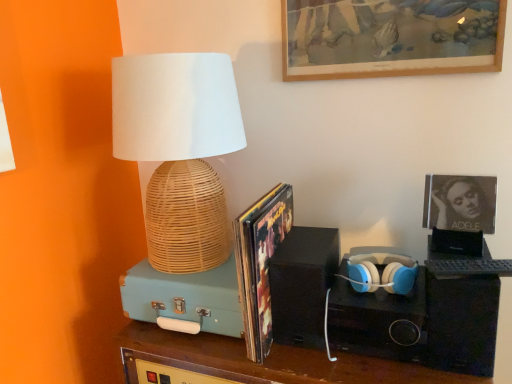
Describe the element at coordinates (184, 299) in the screenshot. I see `teal matte suitcase at left, which is the 1th speaker from left to right` at that location.

This screenshot has height=384, width=512. Identify the location of black matte speaker at center, which is the second speaker from left to right. (302, 284).

I want to click on matte white and blue plastic headphones at center right, so click(x=382, y=273).

What do you see at coordinates (179, 150) in the screenshot? I see `woven bamboo lamp at left` at bounding box center [179, 150].

The image size is (512, 384). What do you see at coordinates (260, 263) in the screenshot? I see `shiny paper magazine at center` at bounding box center [260, 263].

Describe the element at coordinates (255, 363) in the screenshot. This screenshot has height=384, width=512. I see `teal suitcase at center` at that location.

Where is `black matte speaker at right, which appears as the first speaker when viewed from the right`? black matte speaker at right, which appears as the first speaker when viewed from the right is located at coordinates (462, 323).

Is black matte speaker at right, which appears as the first speaker when viewed from the right, with wooden picture frame at upper center, marked as the first picture frame in a top-to-bottom arrangement?

black matte speaker at right, which appears as the first speaker when viewed from the right, and wooden picture frame at upper center, marked as the first picture frame in a top-to-bottom arrangement, are not in contact.

From a real-world perspective, is black matte speaker at right, which appears as the first speaker when viewed from the right, located beneath wooden picture frame at upper center, the 2th picture frame in the bottom-to-top sequence?

Yes, from a real-world perspective, black matte speaker at right, which appears as the first speaker when viewed from the right, is below wooden picture frame at upper center, the 2th picture frame in the bottom-to-top sequence.

Considering the relative sizes of black matte speaker at right, which appears as the first speaker when viewed from the right, and wooden picture frame at upper center, marked as the first picture frame in a top-to-bottom arrangement, in the image provided, is black matte speaker at right, which appears as the first speaker when viewed from the right, shorter than wooden picture frame at upper center, marked as the first picture frame in a top-to-bottom arrangement,?

Incorrect, the height of black matte speaker at right, which appears as the first speaker when viewed from the right, does not fall short of that of wooden picture frame at upper center, marked as the first picture frame in a top-to-bottom arrangement.

Between black matte speaker at right, the 3th speaker positioned from the left, and wooden picture frame at upper center, the 2th picture frame in the bottom-to-top sequence, which one has larger size?

Bigger between the two is black matte speaker at right, the 3th speaker positioned from the left.

From a real-world perspective, who is located lower, wooden picture frame at upper center, marked as the first picture frame in a top-to-bottom arrangement, or black matte speaker at right, the 3th speaker positioned from the left?

In real-world perspective, black matte speaker at right, the 3th speaker positioned from the left, is lower.

Considering the sizes of objects wooden picture frame at upper center, marked as the first picture frame in a top-to-bottom arrangement, and black matte speaker at right, which appears as the first speaker when viewed from the right, in the image provided, who is thinner, wooden picture frame at upper center, marked as the first picture frame in a top-to-bottom arrangement, or black matte speaker at right, which appears as the first speaker when viewed from the right,?

wooden picture frame at upper center, marked as the first picture frame in a top-to-bottom arrangement.

Can you see wooden picture frame at upper center, marked as the first picture frame in a top-to-bottom arrangement, touching black matte speaker at right, the 3th speaker positioned from the left?

No, wooden picture frame at upper center, marked as the first picture frame in a top-to-bottom arrangement, is not next to black matte speaker at right, the 3th speaker positioned from the left.

Which of these two, wooden picture frame at upper center, marked as the first picture frame in a top-to-bottom arrangement, or black matte speaker at right, the 3th speaker positioned from the left, is bigger?

With larger size is black matte speaker at right, the 3th speaker positioned from the left.

Is wooden picture frame at upper center, the 2th picture frame in the bottom-to-top sequence, further to camera compared to black matte speaker at center, marked as the second speaker in a right-to-left arrangement?

Yes.

In terms of height, does wooden picture frame at upper center, the 2th picture frame in the bottom-to-top sequence, look taller or shorter compared to black matte speaker at center, marked as the second speaker in a right-to-left arrangement?

wooden picture frame at upper center, the 2th picture frame in the bottom-to-top sequence, is shorter than black matte speaker at center, marked as the second speaker in a right-to-left arrangement.

From the picture: Are wooden picture frame at upper center, the 2th picture frame in the bottom-to-top sequence, and black matte speaker at center, which is the second speaker from left to right, located far from each other?

No, wooden picture frame at upper center, the 2th picture frame in the bottom-to-top sequence, is in close proximity to black matte speaker at center, which is the second speaker from left to right.

Does black matte speaker at right, which appears as the first speaker when viewed from the right, have a lesser height compared to matte black album cover at upper right, which ranks as the second picture frame in top-to-bottom order?

In fact, black matte speaker at right, which appears as the first speaker when viewed from the right, may be taller than matte black album cover at upper right, which ranks as the second picture frame in top-to-bottom order.

From a real-world perspective, which object rests below the other?

black matte speaker at right, which appears as the first speaker when viewed from the right, from a real-world perspective.

Does point (481, 306) lie behind point (476, 181)?

That is False.

Would you say black matte speaker at right, the 3th speaker positioned from the left, is inside or outside matte black album cover at upper right, which ranks as the second picture frame in top-to-bottom order?

The correct answer is: outside.

Where is `headphones above the teal matte suitcase at left, which appears as the 3th speaker when viewed from the right (from the image's perspective)`? The height and width of the screenshot is (384, 512). headphones above the teal matte suitcase at left, which appears as the 3th speaker when viewed from the right (from the image's perspective) is located at coordinates (382, 273).

How different are the orientations of matte white and blue plastic headphones at center right and teal matte suitcase at left, which is the 1th speaker from left to right, in degrees?

1.74 degrees separate the facing orientations of matte white and blue plastic headphones at center right and teal matte suitcase at left, which is the 1th speaker from left to right.

Between point (356, 260) and point (128, 287), which one is positioned behind?

Point (128, 287)

From a real-world perspective, does matte white and blue plastic headphones at center right sit lower than teal matte suitcase at left, which is the 1th speaker from left to right?

Actually, matte white and blue plastic headphones at center right is physically above teal matte suitcase at left, which is the 1th speaker from left to right, in the real world.

From a real-world perspective, is black matte speaker at center, marked as the second speaker in a right-to-left arrangement, positioned under woven bamboo lamp at left based on gravity?

Correct, in the physical world, black matte speaker at center, marked as the second speaker in a right-to-left arrangement, is lower than woven bamboo lamp at left.

Which is less distant, (317,315) or (208,75)?

The point (317,315) is closer to the camera.

Locate an element on the screen. The image size is (512, 384). lamp in front of the black matte speaker at center, which is the second speaker from left to right is located at coordinates [x=179, y=150].

Is black matte speaker at center, which is the second speaker from left to right, not within woven bamboo lamp at left?

Indeed, black matte speaker at center, which is the second speaker from left to right, is completely outside woven bamboo lamp at left.

How different are the orientations of wooden picture frame at upper center, the 2th picture frame in the bottom-to-top sequence, and teal suitcase at center in degrees?

The facing directions of wooden picture frame at upper center, the 2th picture frame in the bottom-to-top sequence, and teal suitcase at center are 0.368 degrees apart.

Does point (297, 10) appear closer or farther from the camera than point (350, 375)?

Point (297, 10) is positioned farther from the camera compared to point (350, 375).

Who is more distant, wooden picture frame at upper center, the 2th picture frame in the bottom-to-top sequence, or teal suitcase at center?

wooden picture frame at upper center, the 2th picture frame in the bottom-to-top sequence, is behind.

Can you confirm if wooden picture frame at upper center, the 2th picture frame in the bottom-to-top sequence, is thinner than teal suitcase at center?

Indeed, wooden picture frame at upper center, the 2th picture frame in the bottom-to-top sequence, has a lesser width compared to teal suitcase at center.

Locate an element on the screen. Image resolution: width=512 pixels, height=384 pixels. speaker on the right of wooden picture frame at upper center, the 2th picture frame in the bottom-to-top sequence is located at coordinates (462, 323).

There is a wooden picture frame at upper center, the 2th picture frame in the bottom-to-top sequence. Where is `the 1st speaker below it (from a real-world perspective)`? The image size is (512, 384). the 1st speaker below it (from a real-world perspective) is located at coordinates (462, 323).

In the scene shown: Based on their spatial positions, is teal matte suitcase at left, which appears as the 3th speaker when viewed from the right, or teal suitcase at center further from black matte speaker at right, which appears as the first speaker when viewed from the right?

teal matte suitcase at left, which appears as the 3th speaker when viewed from the right, is further to black matte speaker at right, which appears as the first speaker when viewed from the right.

Looking at the image, which one is located further to shiny paper magazine at center, matte black album cover at upper right, which ranks as the first picture frame in bottom-to-top order, or teal matte suitcase at left, which appears as the 3th speaker when viewed from the right?

matte black album cover at upper right, which ranks as the first picture frame in bottom-to-top order, is positioned further to the anchor shiny paper magazine at center.

Based on their spatial positions, is teal suitcase at center or matte white and blue plastic headphones at center right closer to matte black album cover at upper right, which ranks as the first picture frame in bottom-to-top order?

matte white and blue plastic headphones at center right is positioned closer to the anchor matte black album cover at upper right, which ranks as the first picture frame in bottom-to-top order.

Based on their spatial positions, is shiny paper magazine at center or black matte speaker at center, which is the second speaker from left to right, closer to teal suitcase at center?

Based on the image, black matte speaker at center, which is the second speaker from left to right, appears to be nearer to teal suitcase at center.

Based on their spatial positions, is black matte speaker at right, which appears as the first speaker when viewed from the right, or shiny paper magazine at center further from woven bamboo lamp at left?

black matte speaker at right, which appears as the first speaker when viewed from the right, is further to woven bamboo lamp at left.

Looking at the image, which one is located closer to matte black album cover at upper right, which ranks as the first picture frame in bottom-to-top order, wooden picture frame at upper center, marked as the first picture frame in a top-to-bottom arrangement, or teal matte suitcase at left, which appears as the 3th speaker when viewed from the right?

wooden picture frame at upper center, marked as the first picture frame in a top-to-bottom arrangement, is positioned closer to the anchor matte black album cover at upper right, which ranks as the first picture frame in bottom-to-top order.

Based on their spatial positions, is black matte speaker at right, the 3th speaker positioned from the left, or teal suitcase at center closer to teal matte suitcase at left, which appears as the 3th speaker when viewed from the right?

teal suitcase at center is positioned closer to the anchor teal matte suitcase at left, which appears as the 3th speaker when viewed from the right.

Looking at the image, which one is located closer to teal suitcase at center, woven bamboo lamp at left or black matte speaker at right, which appears as the first speaker when viewed from the right?

black matte speaker at right, which appears as the first speaker when viewed from the right, is positioned closer to the anchor teal suitcase at center.

Locate an element on the screen. The height and width of the screenshot is (384, 512). magazine between woven bamboo lamp at left and teal matte suitcase at left, which is the 1th speaker from left to right, in the vertical direction is located at coordinates (260, 263).

The image size is (512, 384). In order to click on headphones located between shiny paper magazine at center and matte black album cover at upper right, which ranks as the second picture frame in top-to-bottom order, in the left-right direction in this screenshot , I will do `click(382, 273)`.

Find the location of a particular element. This screenshot has height=384, width=512. furniture located between teal matte suitcase at left, which appears as the 3th speaker when viewed from the right, and matte white and blue plastic headphones at center right in the left-right direction is located at coordinates (255, 363).

You are a GUI agent. You are given a task and a screenshot of the screen. Output one action in this format:
    pyautogui.click(x=<x>, y=<y>)
    Task: Click on the magazine between wooden picture frame at upper center, the 2th picture frame in the bottom-to-top sequence, and black matte speaker at center, which is the second speaker from left to right, from top to bottom
    The width and height of the screenshot is (512, 384).
    Given the screenshot: What is the action you would take?
    pyautogui.click(x=260, y=263)